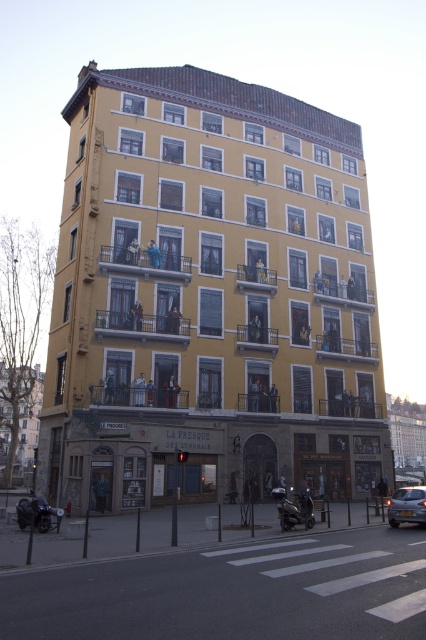
Question: Which of the following is the closest to the observer?

Choices:
 (A) shiny black motorcycle at lower center
 (B) shiny black motorcycle at lower left

Answer: (B)

Question: Does metallic silver car at lower right have a smaller size compared to shiny black motorcycle at lower left?

Choices:
 (A) no
 (B) yes

Answer: (B)

Question: Which object is closer to the camera taking this photo?

Choices:
 (A) shiny black motorcycle at lower left
 (B) metallic silver car at lower right

Answer: (A)

Question: Which object appears closest to the camera in this image?

Choices:
 (A) metallic silver car at lower right
 (B) shiny black motorcycle at lower center
 (C) shiny black motorcycle at lower left

Answer: (C)

Question: Does metallic silver car at lower right lie behind shiny black motorcycle at lower left?

Choices:
 (A) yes
 (B) no

Answer: (A)

Question: Considering the relative positions of metallic silver car at lower right and shiny black motorcycle at lower left in the image provided, where is metallic silver car at lower right located with respect to shiny black motorcycle at lower left?

Choices:
 (A) left
 (B) right

Answer: (B)